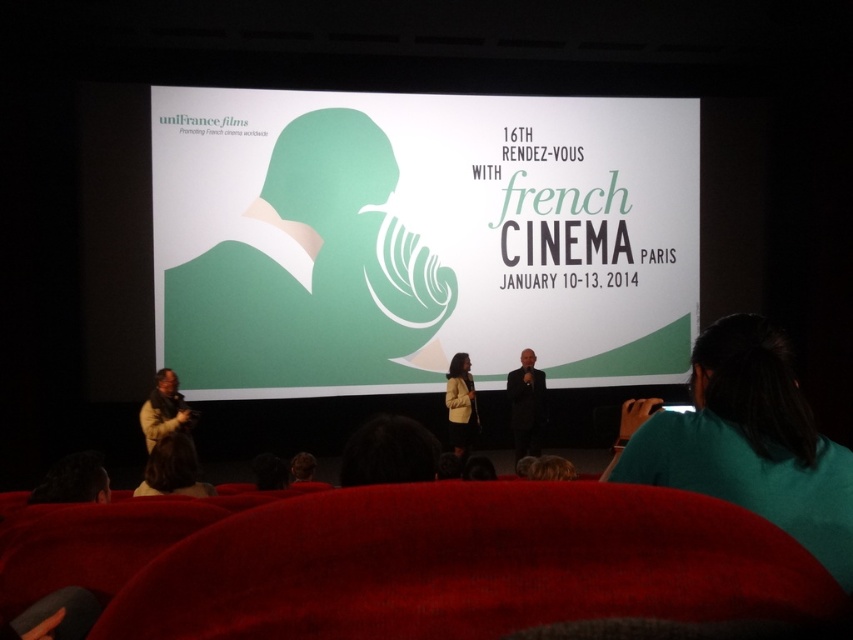
Is green matte shirt at lower right bigger than brown textured coat at left?

Incorrect, green matte shirt at lower right is not larger than brown textured coat at left.

Between green matte shirt at lower right and brown textured coat at left, which one is positioned lower?

brown textured coat at left

Based on the photo, who is more forward, [811,476] or [177,426]?

Point [811,476] is more forward.

You are a GUI agent. You are given a task and a screenshot of the screen. Output one action in this format:
    pyautogui.click(x=<x>, y=<y>)
    Task: Click on the green matte shirt at lower right
    The image size is (853, 640).
    Given the screenshot: What is the action you would take?
    pyautogui.click(x=747, y=442)

Is green paper at center shorter than light brown leather jacket at center?

No.

Identify the location of green paper at center. The width and height of the screenshot is (853, 640). (419, 237).

At what (x,y) coordinates should I click in order to perform the action: click on green paper at center. Please return your answer as a coordinate pair (x, y). Looking at the image, I should click on (419, 237).

Which is in front, point (521, 362) or point (149, 435)?

Point (149, 435) is more forward.

Does point (524, 364) come behind point (172, 429)?

Yes, point (524, 364) is farther from viewer.

Between point (544, 404) and point (155, 440), which one is positioned behind?

The point (544, 404) is behind.

Locate an element on the screen. black suit at center is located at coordinates (526, 404).